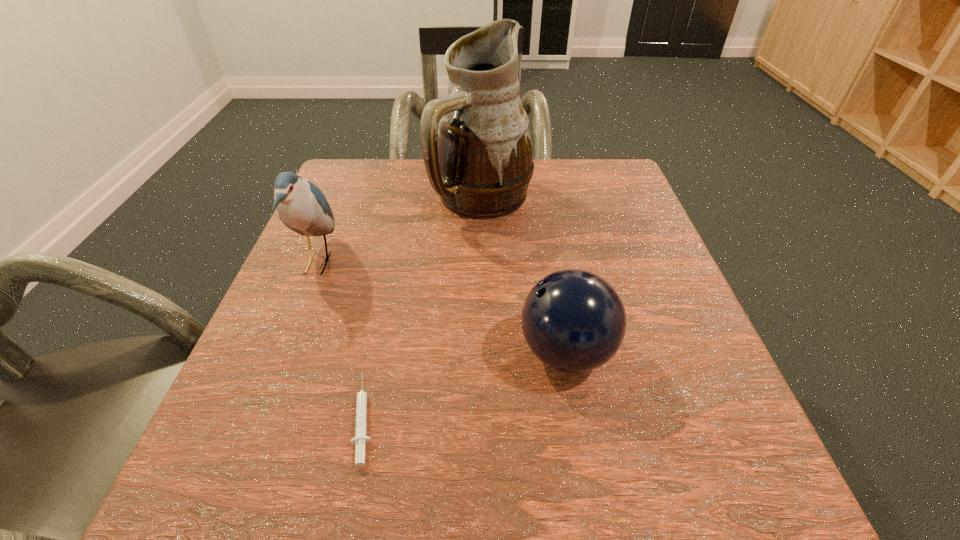
Image resolution: width=960 pixels, height=540 pixels. Find the location of `free point that satisfies the following two spatial constraints: 1. from the spout of the pitcher; 2. at the tip of the leftmost object's beak`. free point that satisfies the following two spatial constraints: 1. from the spout of the pitcher; 2. at the tip of the leftmost object's beak is located at coordinates (483, 263).